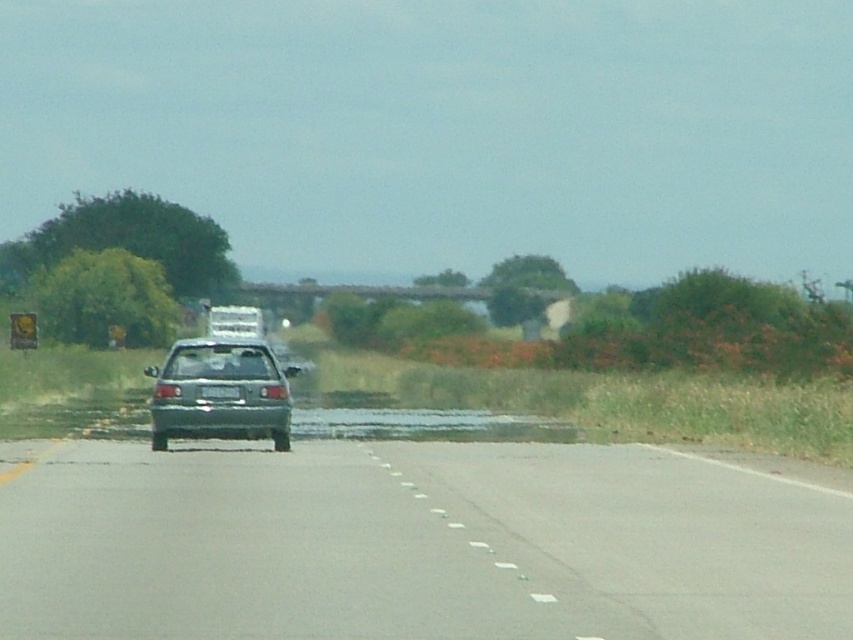
Who is positioned more to the right, gray asphalt highway at center or metallic gray hatchback at center?

From the viewer's perspective, gray asphalt highway at center appears more on the right side.

Is gray asphalt highway at center closer to the viewer compared to metallic gray hatchback at center?

Yes, it is.

Is point (233, 461) closer to viewer compared to point (201, 435)?

Yes, it is in front of point (201, 435).

Identify the location of gray asphalt highway at center. (416, 545).

Does gray asphalt flood at center have a lesser width compared to white plastic license plate at center?

Incorrect, gray asphalt flood at center's width is not less than white plastic license plate at center's.

Which is below, gray asphalt flood at center or white plastic license plate at center?

gray asphalt flood at center is below.

Which is in front, point (297, 417) or point (229, 387)?

Point (229, 387) is more forward.

Locate an element on the screen. This screenshot has width=853, height=640. gray asphalt flood at center is located at coordinates (424, 424).

Is metallic gray hatchback at center positioned before white plastic license plate at center?

Yes, metallic gray hatchback at center is in front of white plastic license plate at center.

Identify the location of metallic gray hatchback at center. (219, 400).